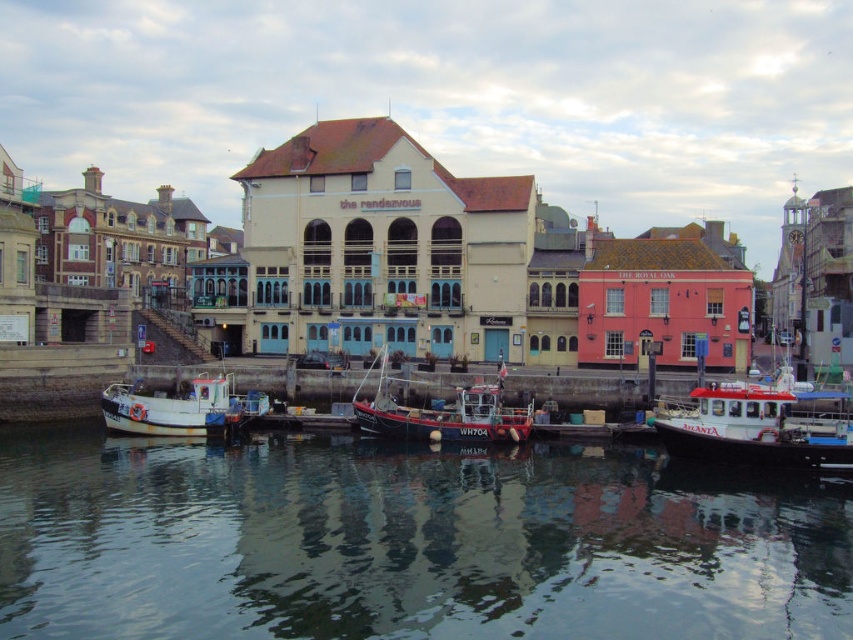
Consider the image. Between transparent water at lower center and wooden fishing boat at center, which one is positioned higher?

Positioned higher is wooden fishing boat at center.

Does point (395, 621) lie behind point (386, 422)?

No, (395, 621) is closer to viewer.

Is point (485, 461) positioned after point (386, 358)?

No, (485, 461) is closer to viewer.

Locate an element on the screen. transparent water at lower center is located at coordinates (405, 544).

Can you confirm if transparent water at lower center is thinner than white plastic boat at right?

In fact, transparent water at lower center might be wider than white plastic boat at right.

Describe the element at coordinates (405, 544) in the screenshot. I see `transparent water at lower center` at that location.

You are a GUI agent. You are given a task and a screenshot of the screen. Output one action in this format:
    pyautogui.click(x=<x>, y=<y>)
    Task: Click on the transparent water at lower center
    
    Given the screenshot: What is the action you would take?
    pyautogui.click(x=405, y=544)

Locate an element on the screen. This screenshot has height=640, width=853. transparent water at lower center is located at coordinates [x=405, y=544].

Is transparent water at lower center positioned before white wooden boat at center?

Result: Yes, it is in front of white wooden boat at center.

Can you confirm if transparent water at lower center is positioned below white wooden boat at center?

Correct, transparent water at lower center is located below white wooden boat at center.

Who is more distant from viewer, (x=744, y=570) or (x=184, y=392)?

The point (x=184, y=392) is behind.

You are a GUI agent. You are given a task and a screenshot of the screen. Output one action in this format:
    pyautogui.click(x=<x>, y=<y>)
    Task: Click on the transparent water at lower center
    This screenshot has width=853, height=640.
    Given the screenshot: What is the action you would take?
    pyautogui.click(x=405, y=544)